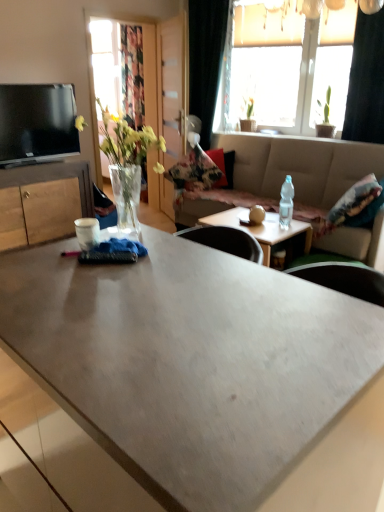
Question: From a real-world perspective, is matte black tv at upper left positioned above or below matte concrete coffee table at center, acting as the 1th coffee table starting from the front?

Choices:
 (A) above
 (B) below

Answer: (A)

Question: Is matte black tv at upper left bigger or smaller than matte concrete coffee table at center, acting as the 1th coffee table starting from the front?

Choices:
 (A) small
 (B) big

Answer: (A)

Question: Estimate the real-world distances between objects in this image. Which object is closer to the matte wooden coffee table at center, acting as the 2th coffee table starting from the front?

Choices:
 (A) wooden cabinet at left
 (B) black matte curtain at upper right, the second curtain viewed from the back
 (C) matte concrete coffee table at center, which is counted as the second coffee table, starting from the back
 (D) beige fabric studio couch at center
 (E) black velvet curtain at upper right, which is counted as the second curtain, starting from the right

Answer: (D)

Question: Which is farther from the black velvet curtain at upper right, which is the 2th curtain in front-to-back order?

Choices:
 (A) beige fabric studio couch at center
 (B) clear glass vase at left
 (C) wooden cabinet at left
 (D) translucent glass window at upper center
 (E) matte black tv at upper left

Answer: (B)